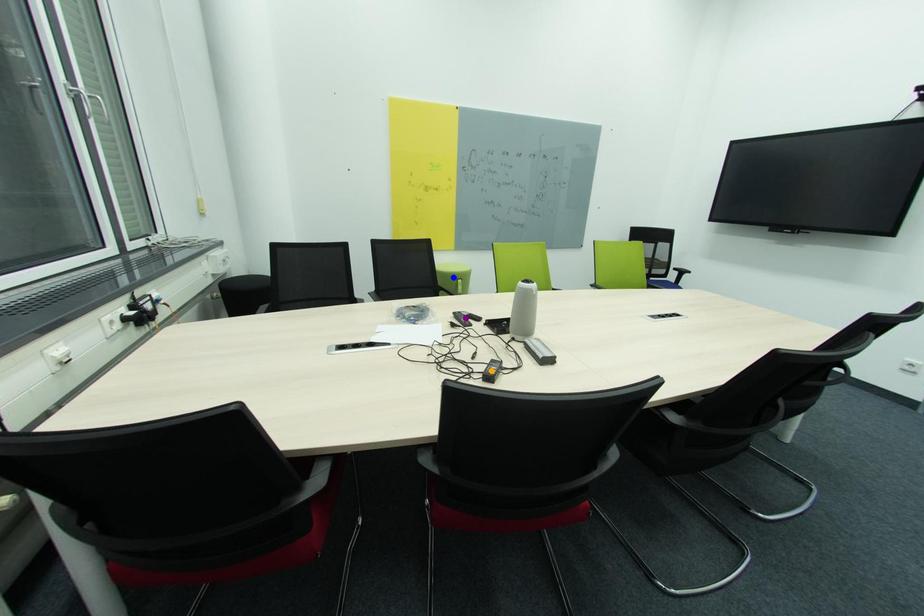
Order these from nearest to farthest:
orange point
blue point
purple point

blue point < purple point < orange point